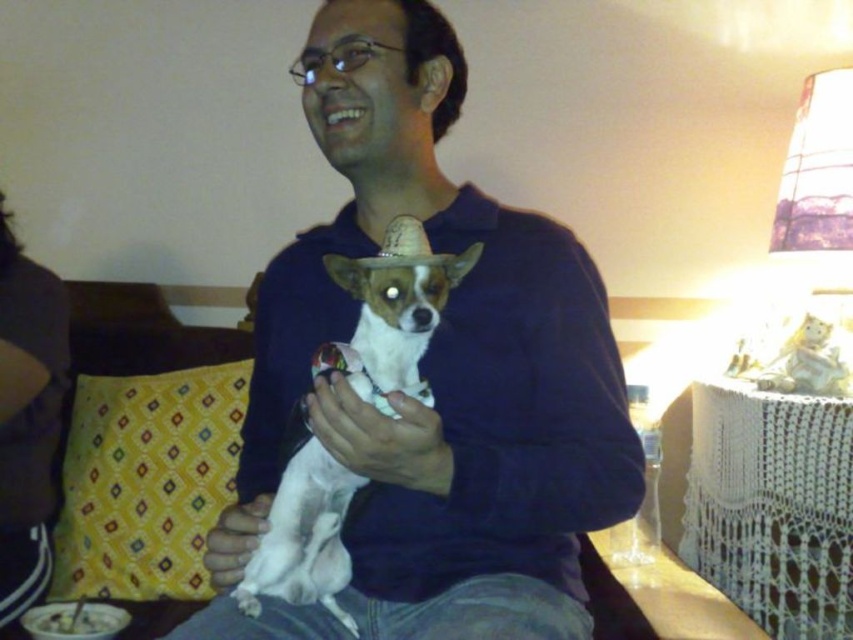
Which is behind, point (428, 26) or point (154, 448)?

Positioned behind is point (154, 448).

Is point (480, 228) positioned behind point (154, 458)?

No, (480, 228) is closer to viewer.

Where is `blue cotton shirt at center`? blue cotton shirt at center is located at coordinates (438, 365).

The height and width of the screenshot is (640, 853). What do you see at coordinates (146, 481) in the screenshot? I see `yellow fabric pillow at lower left` at bounding box center [146, 481].

Is yellow fabric pillow at lower left shorter than white fur dog at center?

Indeed, yellow fabric pillow at lower left has a lesser height compared to white fur dog at center.

Between point (215, 467) and point (415, 323), which one is positioned behind?

Point (215, 467)

Where is `yellow fabric pillow at lower left`? yellow fabric pillow at lower left is located at coordinates (146, 481).

Based on the photo, between blue cotton shirt at center and white fur dog at center, which one has less height?

white fur dog at center is shorter.

The height and width of the screenshot is (640, 853). Describe the element at coordinates (438, 365) in the screenshot. I see `blue cotton shirt at center` at that location.

What are the coordinates of `blue cotton shirt at center` in the screenshot? It's located at (438, 365).